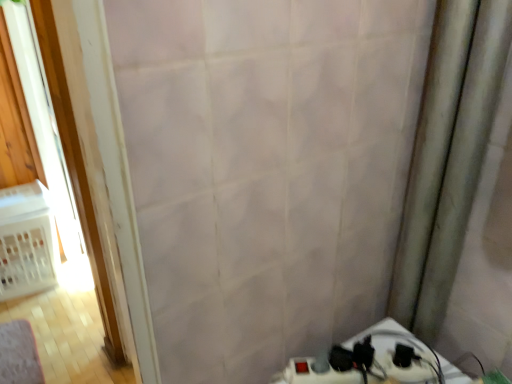
This screenshot has width=512, height=384. What do you see at coordinates (448, 156) in the screenshot?
I see `silky beige curtain at right` at bounding box center [448, 156].

In order to click on silky beige curtain at right in this screenshot , I will do `click(448, 156)`.

At what (x,y) coordinates should I click in order to perform the action: click on silky beige curtain at right. Please return your answer as a coordinate pair (x, y). The height and width of the screenshot is (384, 512). Looking at the image, I should click on (448, 156).